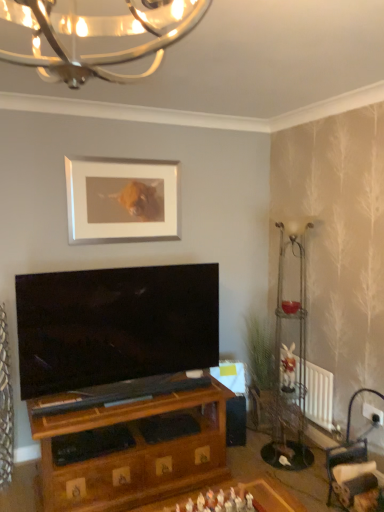
Question: From a real-world perspective, is metallic wire floor lamp at right physically above white matte picture frame at upper center?

Choices:
 (A) yes
 (B) no

Answer: (B)

Question: Is metallic wire floor lamp at right bigger than white matte picture frame at upper center?

Choices:
 (A) yes
 (B) no

Answer: (A)

Question: Is white matte picture frame at upper center at the back of metallic wire floor lamp at right?

Choices:
 (A) no
 (B) yes

Answer: (A)

Question: Is the depth of metallic wire floor lamp at right less than that of white matte picture frame at upper center?

Choices:
 (A) yes
 (B) no

Answer: (A)

Question: Is metallic wire floor lamp at right at the right side of white matte picture frame at upper center?

Choices:
 (A) yes
 (B) no

Answer: (A)

Question: Visually, is metallic wire floor lamp at right positioned to the left or to the right of white matte picture frame at upper center?

Choices:
 (A) left
 (B) right

Answer: (B)

Question: Considering their positions, is metallic wire floor lamp at right located in front of or behind white matte picture frame at upper center?

Choices:
 (A) behind
 (B) front

Answer: (B)

Question: Choose the correct answer: Is metallic wire floor lamp at right inside white matte picture frame at upper center or outside it?

Choices:
 (A) inside
 (B) outside

Answer: (B)

Question: Considering the positions of metallic wire floor lamp at right and white matte picture frame at upper center in the image, is metallic wire floor lamp at right wider or thinner than white matte picture frame at upper center?

Choices:
 (A) thin
 (B) wide

Answer: (B)

Question: From a real-world perspective, is white matte picture frame at upper center physically located above or below metallic wire floor lamp at right?

Choices:
 (A) above
 (B) below

Answer: (A)

Question: Is point (162, 164) positioned closer to the camera than point (304, 375)?

Choices:
 (A) closer
 (B) farther

Answer: (A)

Question: Is white matte picture frame at upper center taller or shorter than metallic wire floor lamp at right?

Choices:
 (A) short
 (B) tall

Answer: (A)

Question: Based on their sizes in the image, would you say white matte picture frame at upper center is bigger or smaller than metallic wire floor lamp at right?

Choices:
 (A) big
 (B) small

Answer: (B)

Question: In terms of size, does metallic textured curtain at left appear bigger or smaller than white radiator at lower right?

Choices:
 (A) big
 (B) small

Answer: (A)

Question: Is metallic textured curtain at left situated inside white radiator at lower right or outside?

Choices:
 (A) outside
 (B) inside

Answer: (A)